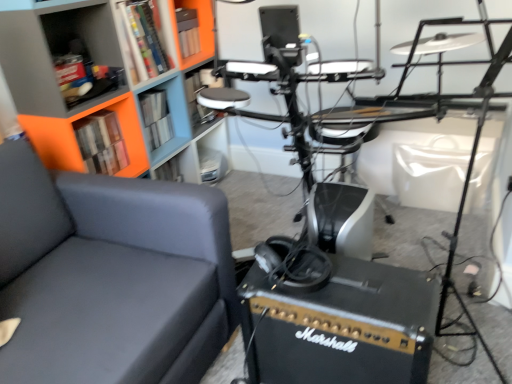
This screenshot has height=384, width=512. Find the location of `free space above black matte marshall amplifier at lower right (from a real-world perspective)`. free space above black matte marshall amplifier at lower right (from a real-world perspective) is located at coordinates (345, 289).